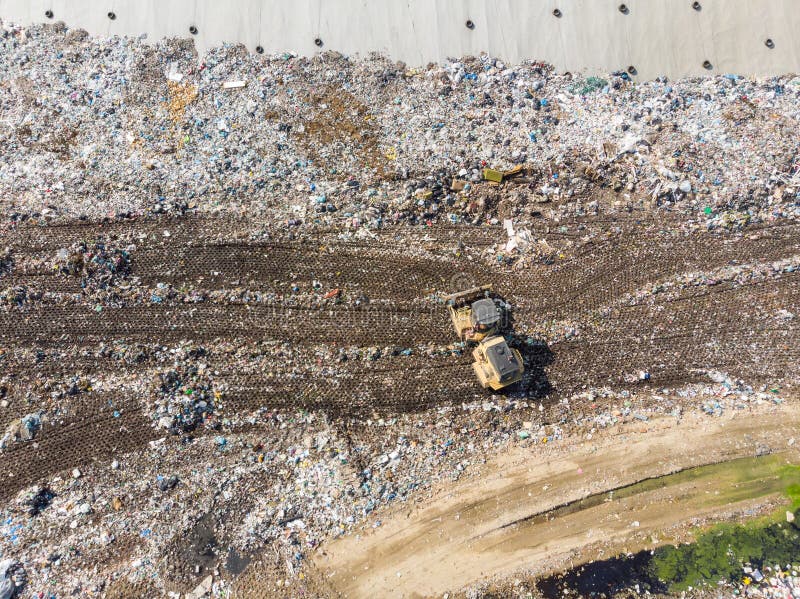
Where is `wall`? Image resolution: width=800 pixels, height=599 pixels. wall is located at coordinates (377, 13), (294, 16).